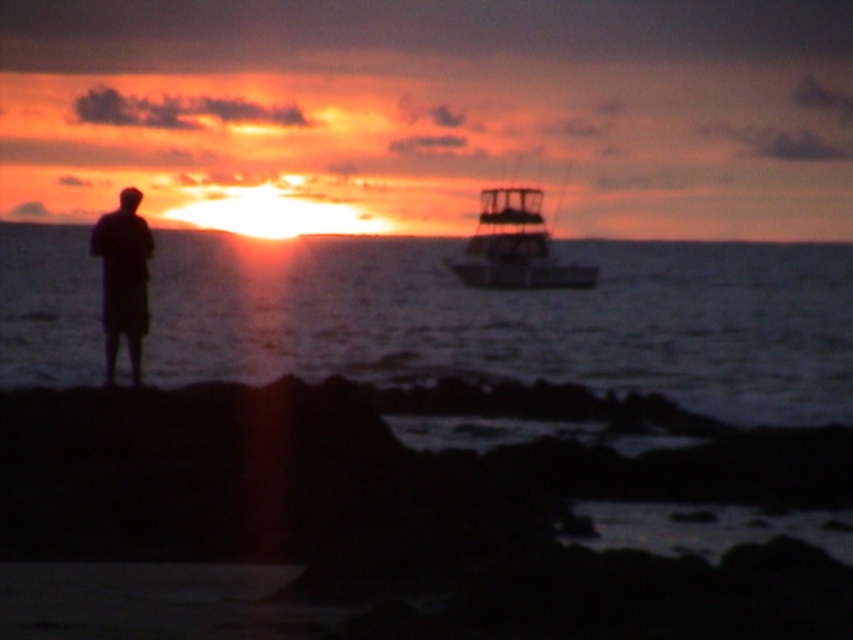
You are a photographer planning to capture the sunset scene. You want to ensure that both the metallic silver boat at upper right and the black matte figure at left are clearly visible in your photo. Based on their positions, which object is more likely to be in focus if you focus on the foreground?

The black matte figure at left is more likely to be in focus because it is closer to the foreground compared to the metallic silver boat at upper right, which is positioned further away.